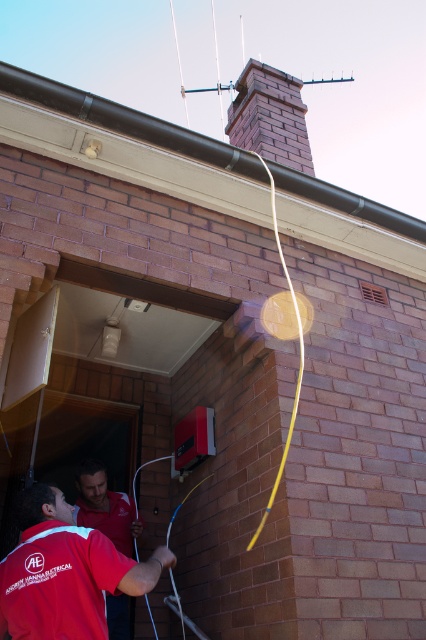
You are a safety inspector standing at the entrance of the building. You need to ensure that the red fabric shirt at lower left and the red brick chimney at center are at least 3 meters apart for safety regulations. Based on the scene, can you confirm if this requirement is met?

The red fabric shirt at lower left is 3.04 meters from the red brick chimney at center, so the safety requirement of at least 3 meters is met.

You are a safety inspector standing at the entrance of the building. You need to ensure that the red brick chimney at center is visible from your current position. Is the red matte shirt at lower left blocking your view of the chimney?

The red brick chimney at center is located above the red matte shirt at lower left, so the shirt is blocking the view of the chimney from your position.